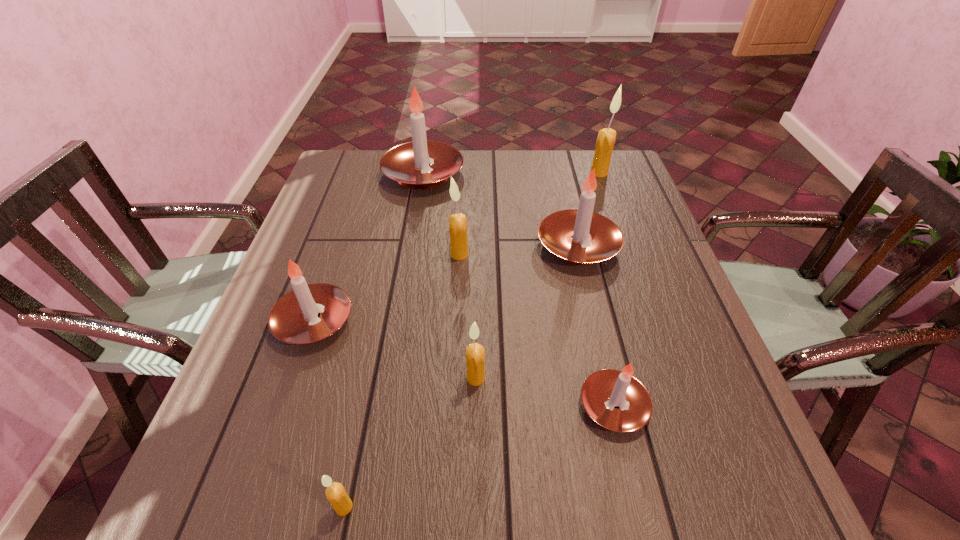
The image size is (960, 540). In order to click on unoccupied area between the fourth nearest object and the nearest candle in this screenshot , I will do `click(329, 414)`.

Locate an element on the screen. unoccupied area between the second cream candle from right to left and the nearest white candle is located at coordinates (544, 392).

At what (x,y) coordinates should I click in order to perform the action: click on free area in between the leftmost cream candle and the rightmost cream candle. Please return your answer as a coordinate pair (x, y). Image resolution: width=960 pixels, height=540 pixels. Looking at the image, I should click on (471, 340).

The height and width of the screenshot is (540, 960). I want to click on free point between the second nearest white candle and the fifth object from left to right, so click(x=395, y=349).

The height and width of the screenshot is (540, 960). Find the location of `free space between the second cream candle from left to right and the nearest object`. free space between the second cream candle from left to right and the nearest object is located at coordinates (401, 381).

The width and height of the screenshot is (960, 540). What are the coordinates of `blank region between the smallest white candle and the rightmost cream candle` in the screenshot? It's located at (607, 289).

Locate an element on the screen. The image size is (960, 540). vacant region between the smallest white candle and the fourth nearest candle is located at coordinates (464, 363).

Locate an element on the screen. empty space that is in between the third cream candle from right to left and the fourth nearest object is located at coordinates (387, 288).

Select which object appears as the fifth closest to the nearest object. Please provide its 2D coordinates. Your answer should be formatted as a tuple, i.e. [(x, y)], where the tuple contains the x and y coordinates of a point satisfying the conditions above.

[(580, 236)]

Identify which object is the sixth closest to the second smallest cream candle. Please provide its 2D coordinates. Your answer should be formatted as a tuple, i.e. [(x, y)], where the tuple contains the x and y coordinates of a point satisfying the conditions above.

[(408, 163)]